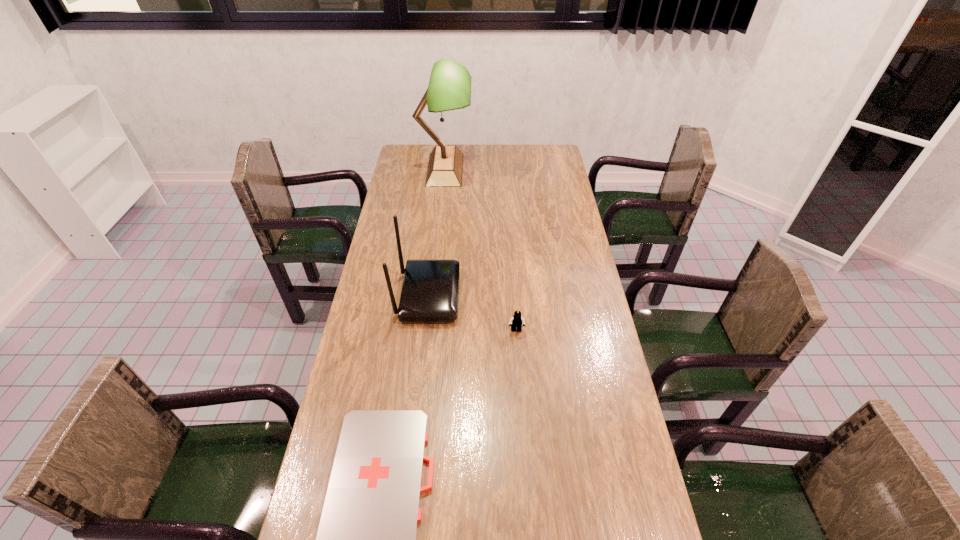
This screenshot has width=960, height=540. Identify the location of free spot between the third farthest object and the tallest object. (481, 250).

What are the coordinates of `empty location between the second farthest object and the tallest object` in the screenshot? It's located at (437, 232).

The height and width of the screenshot is (540, 960). I want to click on vacant point located between the table lamp and the Lego, so click(481, 250).

Identify the location of the third closest object to the router. (449, 88).

The image size is (960, 540). Identify the location of object identified as the second closest to the rightmost object. (367, 537).